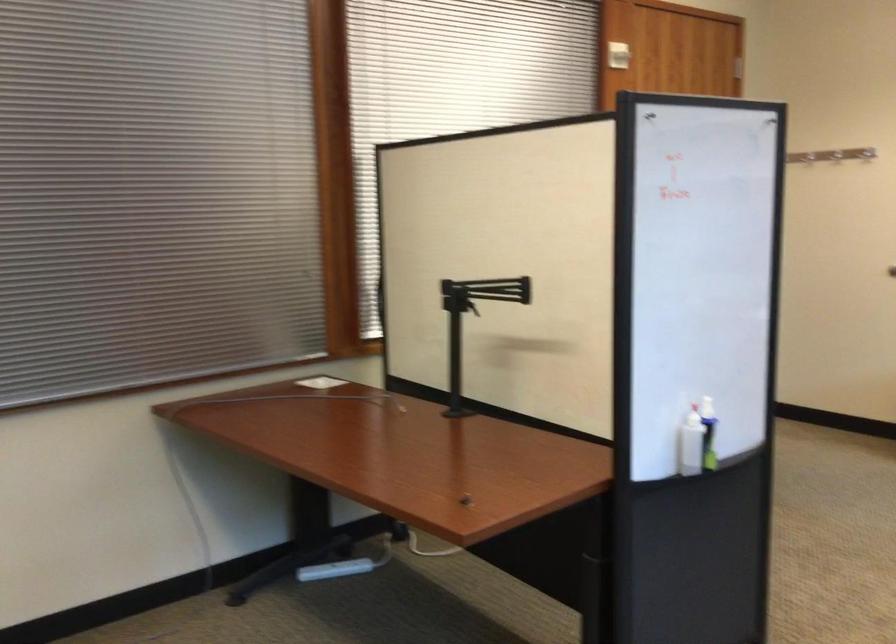
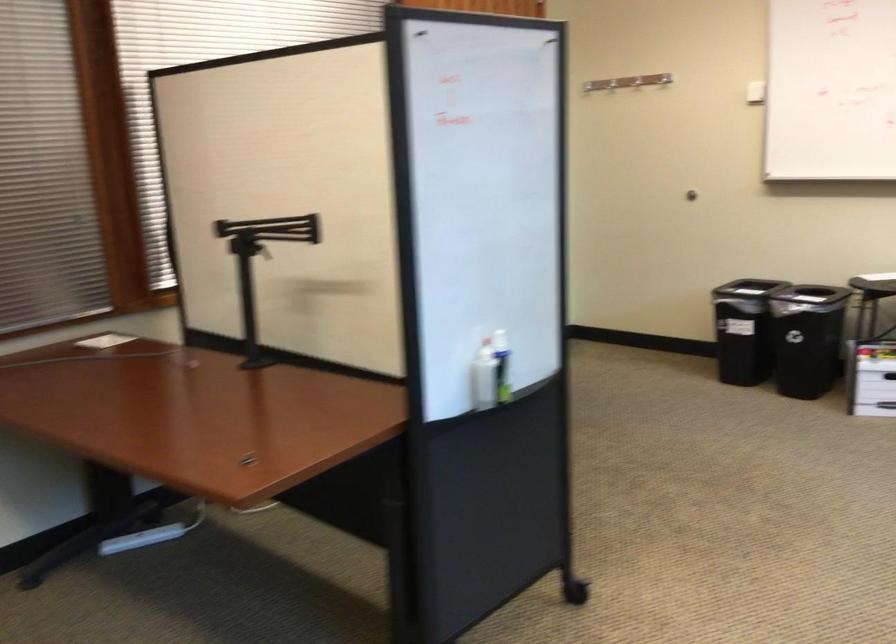
Locate, in the second image, the point that corresponds to [692,440] in the first image.

(483, 377)